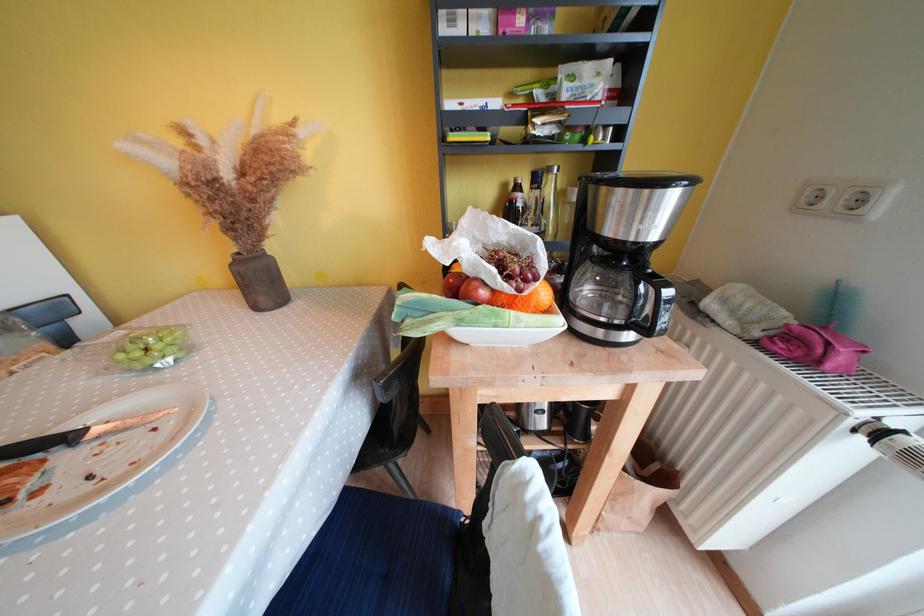
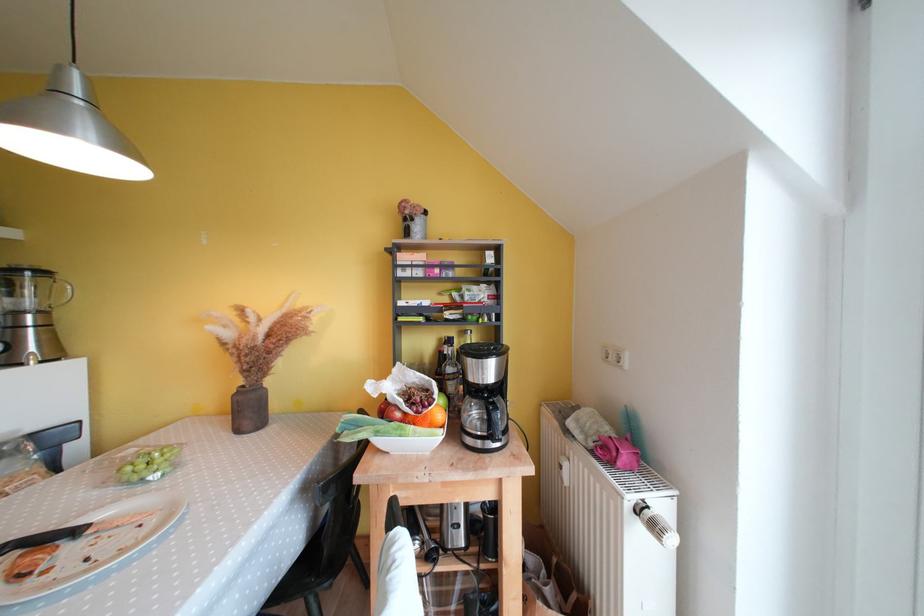
The point at (511, 188) is marked in the first image. Where is the corresponding point in the second image?

(446, 342)